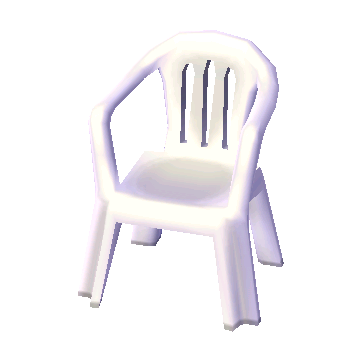
The width and height of the screenshot is (362, 362). Identify the location of seat. (179, 187).